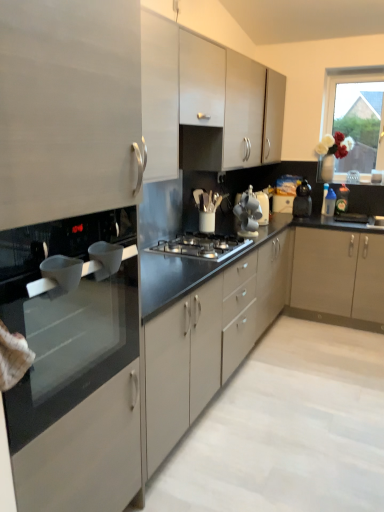
Question: In terms of size, does white glossy cup at left, arranged as the third appliance when viewed from the back, appear bigger or smaller than black glass stove at left, the first countertop when ordered from front to back?

Choices:
 (A) small
 (B) big

Answer: (A)

Question: Based on their positions, is white glossy cup at left, placed as the third appliance when sorted from right to left, located to the left or right of black glass stove at left, the second countertop from the back?

Choices:
 (A) left
 (B) right

Answer: (B)

Question: Which object is positioned closest to the white ceramic cups at center, placed as the 2th appliance when sorted from left to right?

Choices:
 (A) black plastic kettle at right
 (B) metallic silver toaster at center, the third appliance in the front-to-back sequence
 (C) black matte countertop at center, which ranks as the 2th countertop in front-to-back order
 (D) black glass stove at left, the first countertop when ordered from front to back
 (E) stainless steel gas stove at center

Answer: (B)

Question: Which object is the closest to the stainless steel gas stove at center?

Choices:
 (A) black glass stove at left, the second countertop from the back
 (B) metallic silver toaster at center, the third appliance in the front-to-back sequence
 (C) matte white cabinet at upper center
 (D) white ceramic cups at center, placed as the 2th appliance when sorted from left to right
 (E) white glass vase at upper right

Answer: (D)